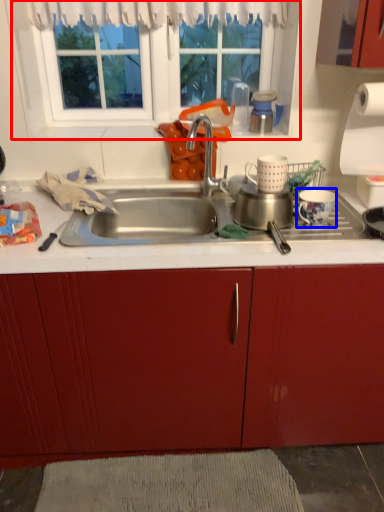
Question: Which object is closer to the camera taking this photo, window (highlighted by a red box) or coffee cup (highlighted by a blue box)?

Choices:
 (A) window
 (B) coffee cup

Answer: (B)